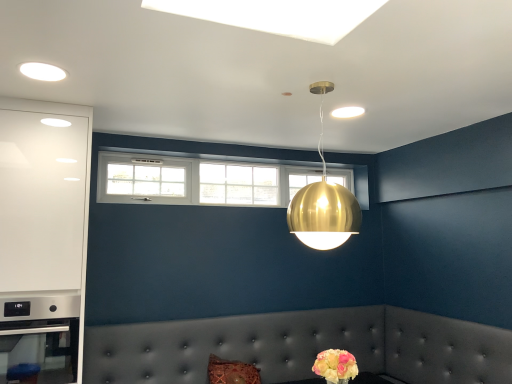
Question: Is pastel yellow bouquet at lower right wider or thinner than gold metallic sphere at upper center?

Choices:
 (A) thin
 (B) wide

Answer: (A)

Question: Considering the relative positions of pastel yellow bouquet at lower right and gold metallic sphere at upper center in the image provided, is pastel yellow bouquet at lower right to the left or to the right of gold metallic sphere at upper center?

Choices:
 (A) right
 (B) left

Answer: (A)

Question: Which is nearer to the pastel yellow bouquet at lower right?

Choices:
 (A) satin silver oven at lower left
 (B) tufted leather couch at lower center
 (C) white glass window at upper center
 (D) gold metallic sphere at upper center
 (E) white glossy cabinet at left

Answer: (D)

Question: Considering the real-world distances, which object is closest to the white glossy cabinet at left?

Choices:
 (A) pastel yellow bouquet at lower right
 (B) white glass window at upper center
 (C) satin silver oven at lower left
 (D) gold metallic sphere at upper center
 (E) tufted leather couch at lower center

Answer: (C)